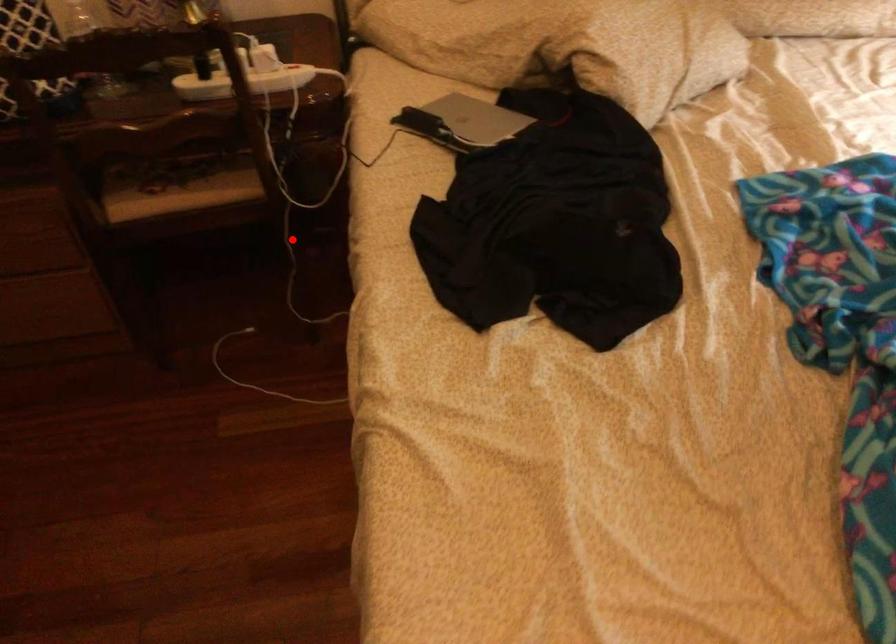
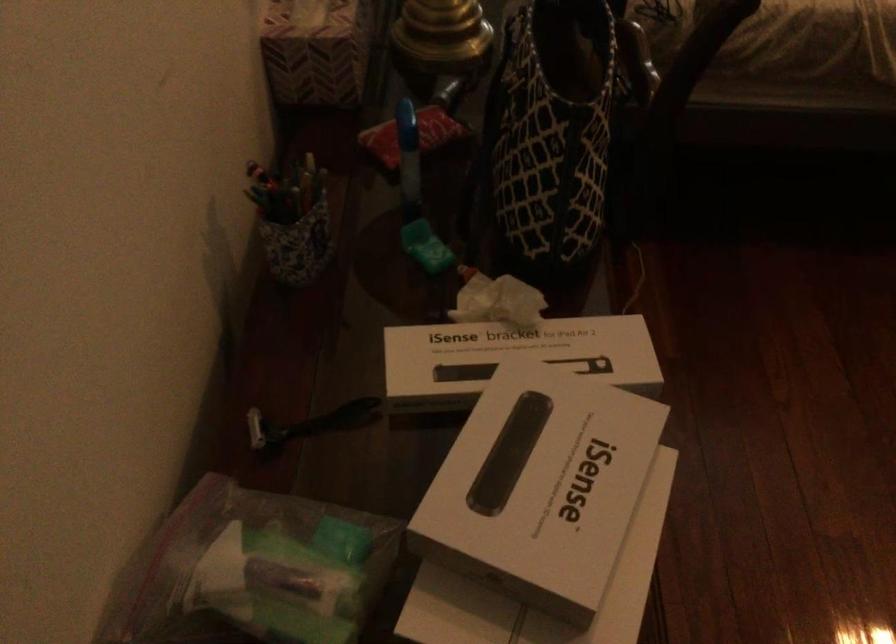
Question: I am providing you with two images of the same scene from different viewpoints. A red point is marked on the first image. Is the red point's position out of view in image 2?

Choices:
 (A) Yes
 (B) No

Answer: (A)